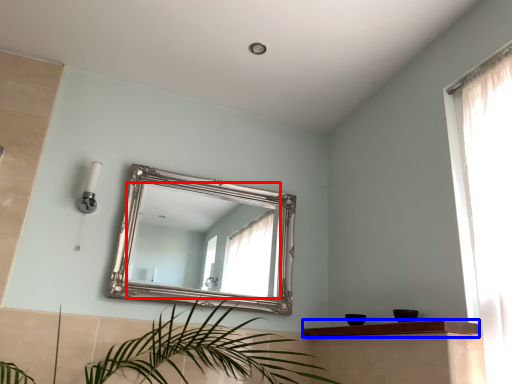
Question: Which of the following is the closest to the observer, mirror (highlighted by a red box) or balustrade (highlighted by a blue box)?

Choices:
 (A) mirror
 (B) balustrade

Answer: (B)